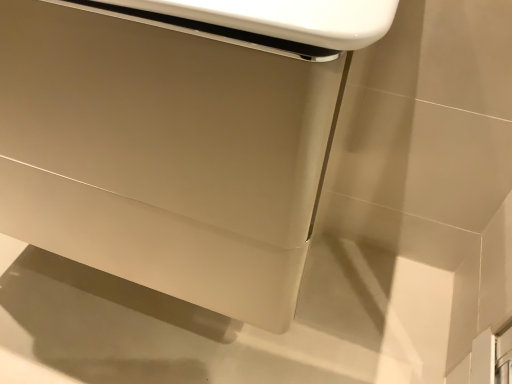
This screenshot has height=384, width=512. Identify the location of matte white cabinet at center. (177, 138).

The width and height of the screenshot is (512, 384). What do you see at coordinates (177, 138) in the screenshot? I see `matte white cabinet at center` at bounding box center [177, 138].

I want to click on matte white cabinet at center, so click(x=177, y=138).